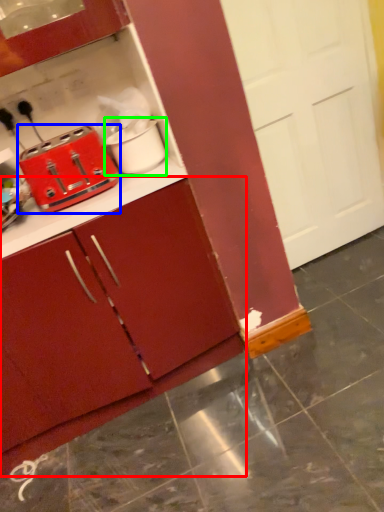
Question: Which object is positioned farthest from cabinetry (highlighted by a red box)? Select from toaster (highlighted by a blue box) and appliance (highlighted by a green box).

Choices:
 (A) toaster
 (B) appliance

Answer: (B)